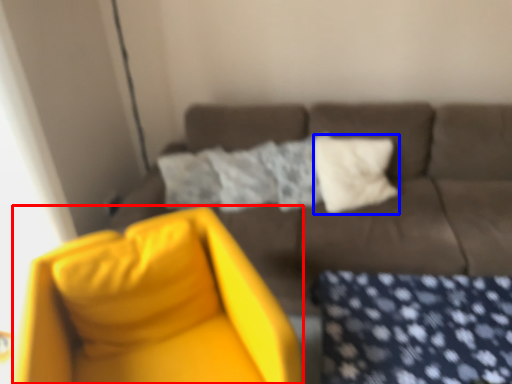
Question: Which object appears closest to the camera in this image, swivel chair (highlighted by a red box) or pillow (highlighted by a blue box)?

Choices:
 (A) swivel chair
 (B) pillow

Answer: (A)